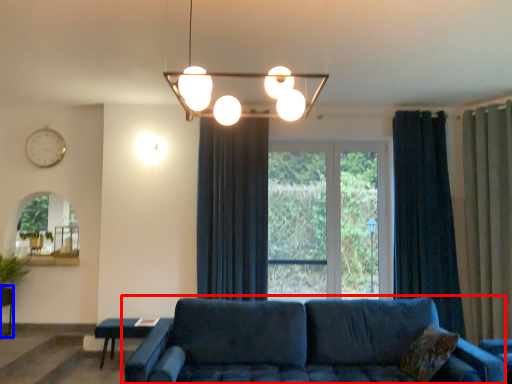
Question: Which object is further to the camera taking this photo, studio couch (highlighted by a red box) or table (highlighted by a blue box)?

Choices:
 (A) studio couch
 (B) table

Answer: (B)